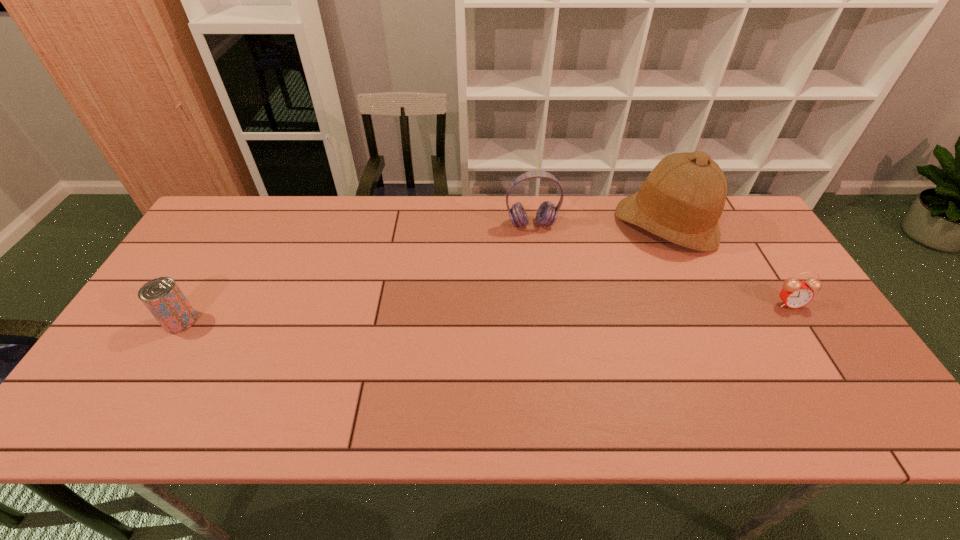
The image size is (960, 540). Find the location of `empty location between the hat and the beer can`. empty location between the hat and the beer can is located at coordinates (422, 273).

You are a GUI agent. You are given a task and a screenshot of the screen. Output one action in this format:
    pyautogui.click(x=<x>, y=<y>)
    Task: Click on the vacant area that lies between the second object from right to left and the second object from left to right
    
    Given the screenshot: What is the action you would take?
    pyautogui.click(x=598, y=224)

At what (x,y) coordinates should I click in order to perform the action: click on free spot between the leftmost object and the second object from left to right. Please return your answer as a coordinate pair (x, y). Image resolution: width=960 pixels, height=540 pixels. Looking at the image, I should click on point(356,273).

This screenshot has height=540, width=960. Find the location of `empty location between the hat and the alarm clock`. empty location between the hat and the alarm clock is located at coordinates (727, 264).

This screenshot has height=540, width=960. I want to click on vacant space that's between the rightmost object and the beer can, so click(x=485, y=312).

Find the location of a particular element. blank region between the tallest object and the leftmost object is located at coordinates (422, 273).

You are a GUI agent. You are given a task and a screenshot of the screen. Output one action in this format:
    pyautogui.click(x=<x>, y=<y>)
    Task: Click on the object identified as the second closest to the rightmost object
    The width and height of the screenshot is (960, 540).
    Given the screenshot: What is the action you would take?
    pyautogui.click(x=547, y=213)

Find the location of a particular element. object that stands as the third closest to the second object from left to right is located at coordinates (163, 298).

Identify the location of vacant region that satisfies the following two spatial constraints: 1. on the back side of the leftmost object; 2. on the left side of the headset. (239, 224).

At what (x,y) coordinates should I click in order to perform the action: click on free location that satisfies the following two spatial constraints: 1. on the back side of the tallest object; 2. on the left side of the leftmost object. Please return your answer as a coordinate pair (x, y). The height and width of the screenshot is (540, 960). Looking at the image, I should click on (239, 224).